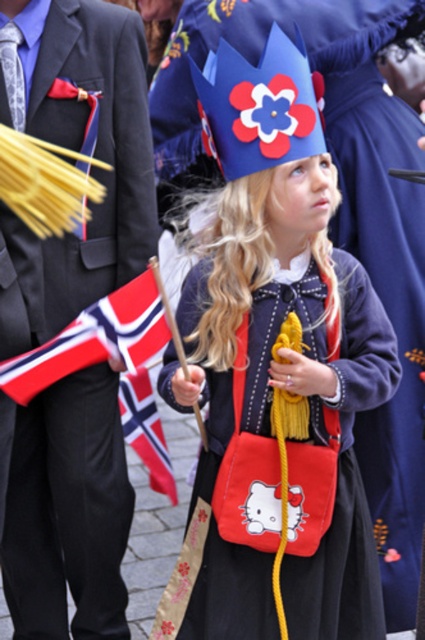
Does red and white fabric flag at lower left have a lesser height compared to red fabric flag at center?

Yes.

Between red and white fabric flag at lower left and red fabric flag at center, which one appears on the right side from the viewer's perspective?

Positioned to the right is red fabric flag at center.

Which is in front, point (147, 333) or point (164, 493)?

Point (147, 333) is more forward.

Find the location of `red and white fabric flag at lower left`. red and white fabric flag at lower left is located at coordinates (x=96, y=339).

Who is shorter, matte black suit at left or red fabric flag at center?

red fabric flag at center

Looking at this image, between matte black suit at left and red fabric flag at center, which one has more height?

Answer: matte black suit at left

Find the location of `matte black suit at left`. matte black suit at left is located at coordinates (85, 134).

From the picture: Which is above, matte black suit at left or red and white fabric flag at lower left?

Positioned higher is red and white fabric flag at lower left.

Does matte black suit at left have a larger size compared to red and white fabric flag at lower left?

Correct, matte black suit at left is larger in size than red and white fabric flag at lower left.

Is point (139, 172) farther from camera compared to point (116, 301)?

That is True.

Find the location of `matte black suit at left`. matte black suit at left is located at coordinates (85, 134).